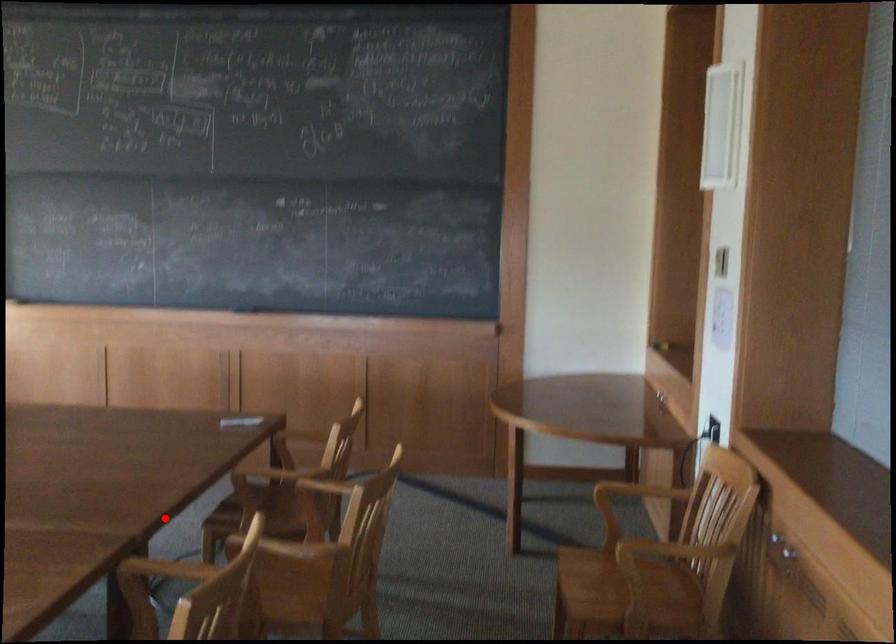
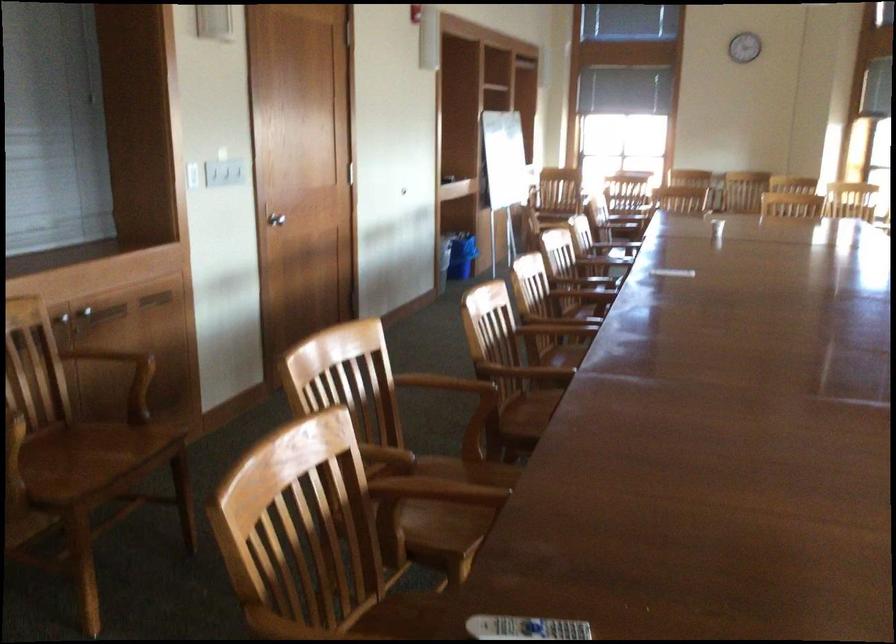
In the second image, find the point that corresponds to the highlighted location in the first image.

(436, 489)